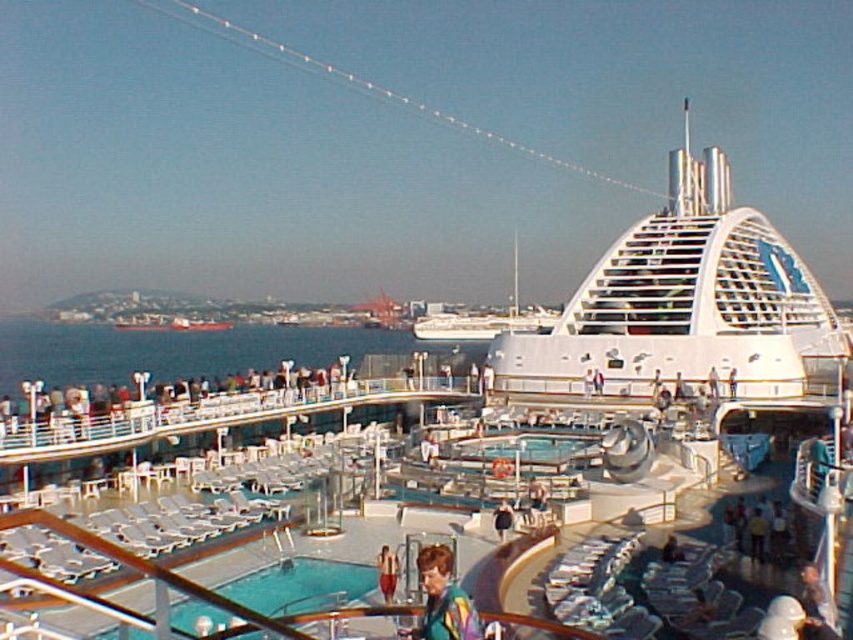
Who is positioned more to the right, multicolored fabric at center or metallic gray ship at center?

From the viewer's perspective, multicolored fabric at center appears more on the right side.

Can you confirm if multicolored fabric at center is positioned to the right of metallic gray ship at center?

Correct, you'll find multicolored fabric at center to the right of metallic gray ship at center.

Is point (445, 579) positioned after point (215, 323)?

No, (445, 579) is in front of (215, 323).

Locate an element on the screen. The image size is (853, 640). multicolored fabric at center is located at coordinates (444, 600).

From the picture: Can you confirm if white glossy cruise ship at upper center is wider than smooth skin at center?

Yes, white glossy cruise ship at upper center is wider than smooth skin at center.

Based on the photo, can you confirm if white glossy cruise ship at upper center is positioned above smooth skin at center?

Indeed, white glossy cruise ship at upper center is positioned over smooth skin at center.

Who is more distant from viewer, (764,246) or (665,541)?

The point (764,246) is behind.

Identify the location of white glossy cruise ship at upper center. This screenshot has width=853, height=640. (683, 308).

Is point (229, 324) positioned in front of point (672, 557)?

That is False.

The width and height of the screenshot is (853, 640). Describe the element at coordinates (196, 323) in the screenshot. I see `metallic gray ship at center` at that location.

Who is more forward, [181,330] or [671,561]?

Point [671,561]

Locate an element on the screen. This screenshot has height=640, width=853. metallic gray ship at center is located at coordinates (196, 323).